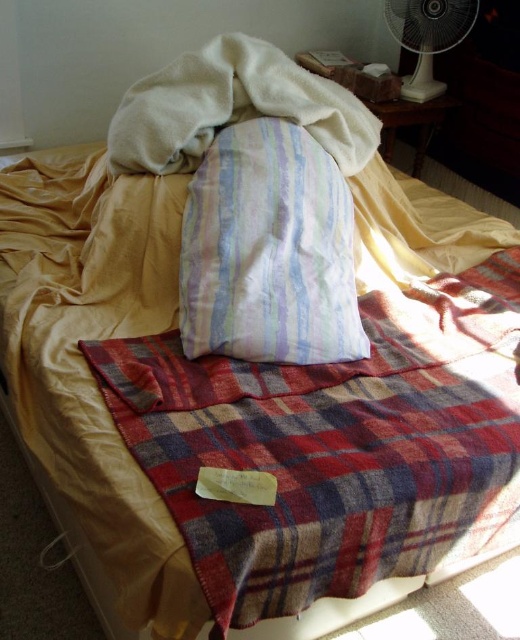
Does striped fabric pillow at center appear under white soft towel at upper center?

Yes.

Who is positioned more to the left, striped fabric pillow at center or white soft towel at upper center?

Positioned to the left is white soft towel at upper center.

Which is behind, point (304, 138) or point (158, 115)?

The point (304, 138) is behind.

Locate an element on the screen. The image size is (520, 640). striped fabric pillow at center is located at coordinates (268, 250).

Between point (339, 246) and point (437, 33), which one is positioned in front?

Point (339, 246) is more forward.

You are a GUI agent. You are given a task and a screenshot of the screen. Output one action in this format:
    pyautogui.click(x=<x>, y=<y>)
    Task: Click on the striped fabric pillow at center
    This screenshot has height=640, width=520.
    Given the screenshot: What is the action you would take?
    pyautogui.click(x=268, y=250)

Is white soft towel at upper center above white plastic fan at upper right?

No, white soft towel at upper center is not above white plastic fan at upper right.

Who is positioned more to the right, white soft towel at upper center or white plastic fan at upper right?

white plastic fan at upper right is more to the right.

You are a GUI agent. You are given a task and a screenshot of the screen. Output one action in this format:
    pyautogui.click(x=<x>, y=<y>)
    Task: Click on the white soft towel at upper center
    The width and height of the screenshot is (520, 640).
    Given the screenshot: What is the action you would take?
    pyautogui.click(x=232, y=108)

Where is `white soft towel at upper center`? The width and height of the screenshot is (520, 640). white soft towel at upper center is located at coordinates (232, 108).